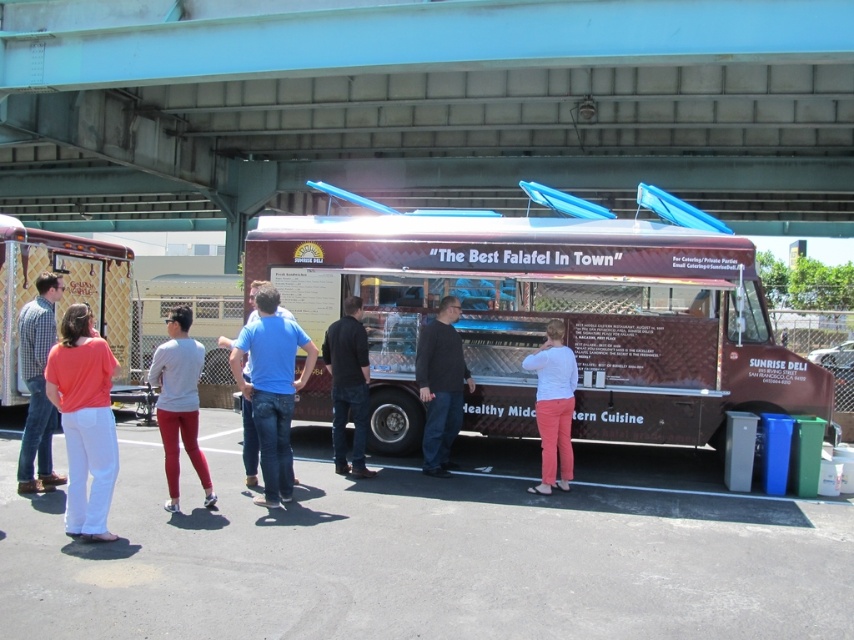
You are a photographer trying to capture the crowd around the food truck. You notice two people wearing the matte coral blouse at left and the matte plaid shirt at lower left. Which person should you focus on to include more of their clothing in the frame?

The matte plaid shirt at lower left occupies more space, so focusing on it will allow you to include more of their clothing in the frame.

You are a customer at the food truck event and want to order from The Best Falafel In Town. You notice two people nearby wearing a dark brown leather jacket at center and a matte plaid shirt at lower left. Which person is closer to the food truck?

The dark brown leather jacket at center is to the right of the matte plaid shirt at lower left. Since the food truck is at the center, the person wearing the dark brown leather jacket at center is closer to the food truck.